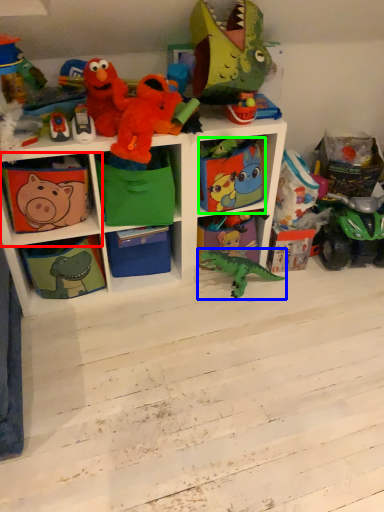
Question: Which object is positioned farthest from shelf (highlighted by a red box)? Select from toy (highlighted by a blue box) and box (highlighted by a green box).

Choices:
 (A) toy
 (B) box

Answer: (A)